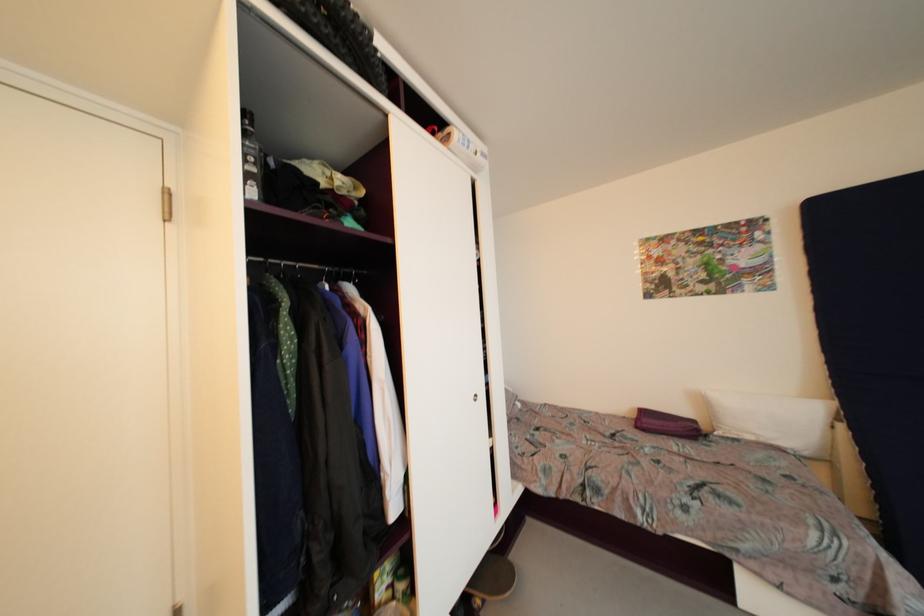
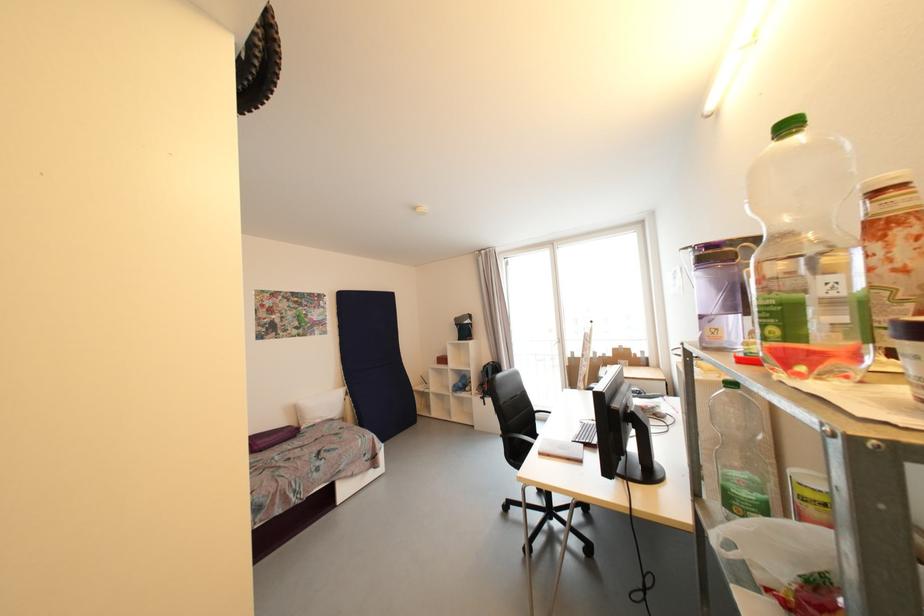
Question: I am providing you with two images of the same scene from different viewpoints. Please identify which objects are invisible in image2.

Choices:
 (A) purple water pitcher
 (B) white plastic tub
 (C) large plastic bottle
 (D) none of these

Answer: (D)